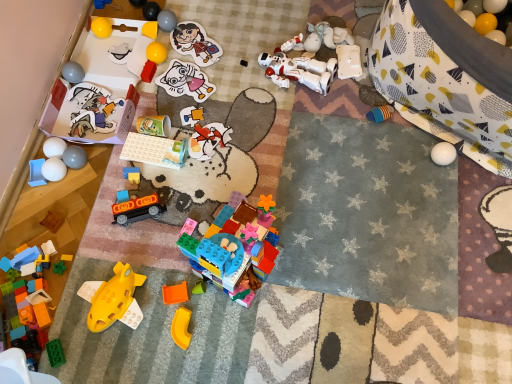
Where is `vacant area that lies between matte paper sticker at center, the nineteenth toy when ordered from left to right, and yellow matte plastic arch at center, which is the 5th toy in right-to-left order`? The height and width of the screenshot is (384, 512). vacant area that lies between matte paper sticker at center, the nineteenth toy when ordered from left to right, and yellow matte plastic arch at center, which is the 5th toy in right-to-left order is located at coordinates (187, 178).